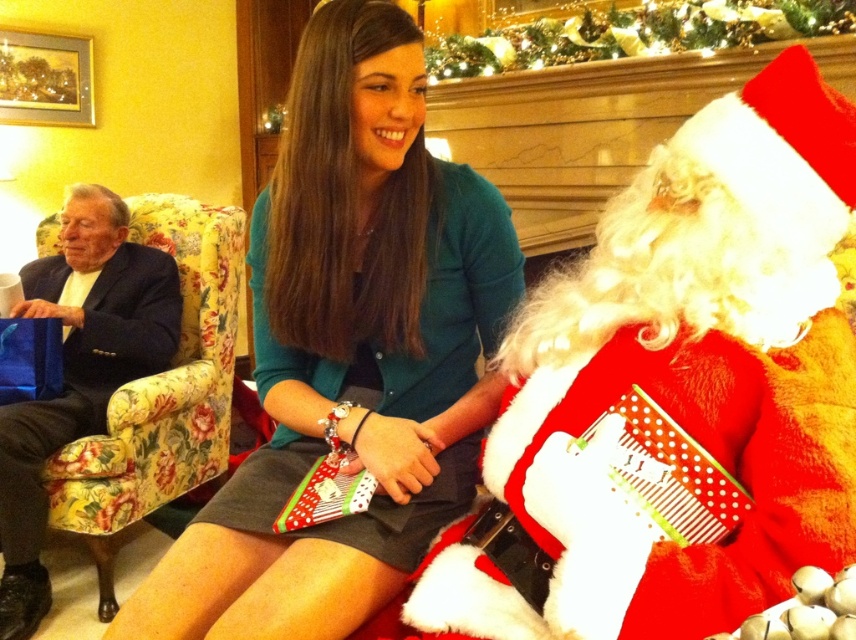
You are a guest at the holiday gathering and want to take a photo with both the red velvet santa at center and the teal sweater at center in the same frame. Based on their positions, which direction should you move to ensure both are visible?

You should move to the left so that both the red velvet santa at center and the teal sweater at center are visible in the frame since the red velvet santa at center is to the right of the teal sweater at center.

You are a guest at this holiday gathering and want to sit down. There is a red velvet santa at center and a floral fabric armchair at left. Which one is closer to you so you can sit?

The red velvet santa at center is closer to the viewer than the floral fabric armchair at left, so you should sit on the floral fabric armchair at left since it is farther away.